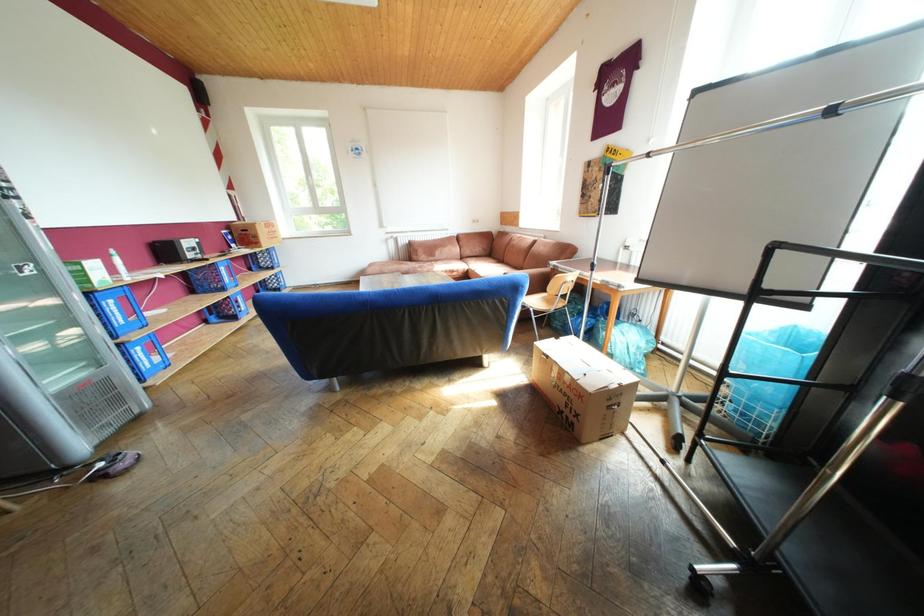
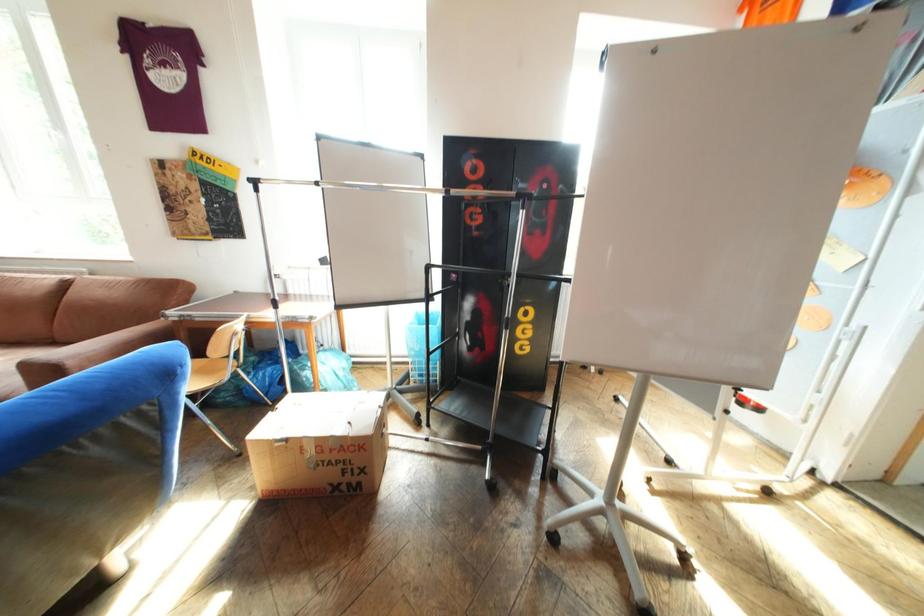
Question: How did the camera likely rotate?

Choices:
 (A) Left
 (B) Right
 (C) Up
 (D) Down

Answer: (B)